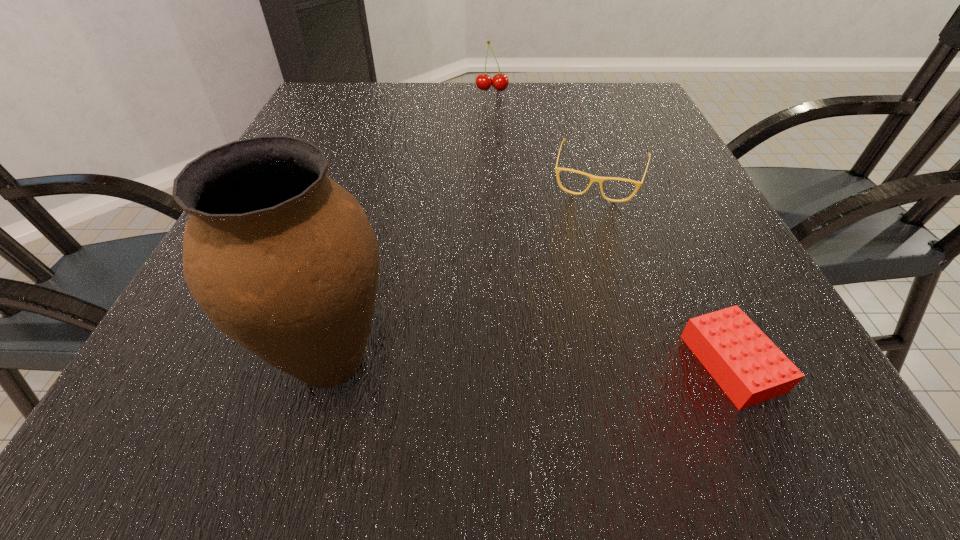
Where is `vacant region located 0.340m in front of the lenses of the spectacles`? vacant region located 0.340m in front of the lenses of the spectacles is located at coordinates (556, 335).

Identify the location of vacant region located 0.270m with the stems of the cherry pointing upwards. The width and height of the screenshot is (960, 540). (490, 143).

Find the location of a particular element. This screenshot has height=540, width=960. vacant area located 0.280m with the stems of the cherry pointing upwards is located at coordinates (490, 145).

I want to click on free location located 0.150m with the stems of the cherry pointing upwards, so click(x=491, y=119).

This screenshot has width=960, height=540. I want to click on object at the far edge, so click(500, 81).

Image resolution: width=960 pixels, height=540 pixels. In order to click on urn that is at the near edge in this screenshot , I will do `click(284, 260)`.

Image resolution: width=960 pixels, height=540 pixels. I want to click on Lego that is positioned at the near edge, so click(747, 365).

Locate an element on the screen. object that is positioned at the left edge is located at coordinates (284, 260).

Find the location of a particular element. The width and height of the screenshot is (960, 540). Lego that is at the right edge is located at coordinates (747, 365).

The height and width of the screenshot is (540, 960). Identify the location of spectacles that is at the right edge. (593, 178).